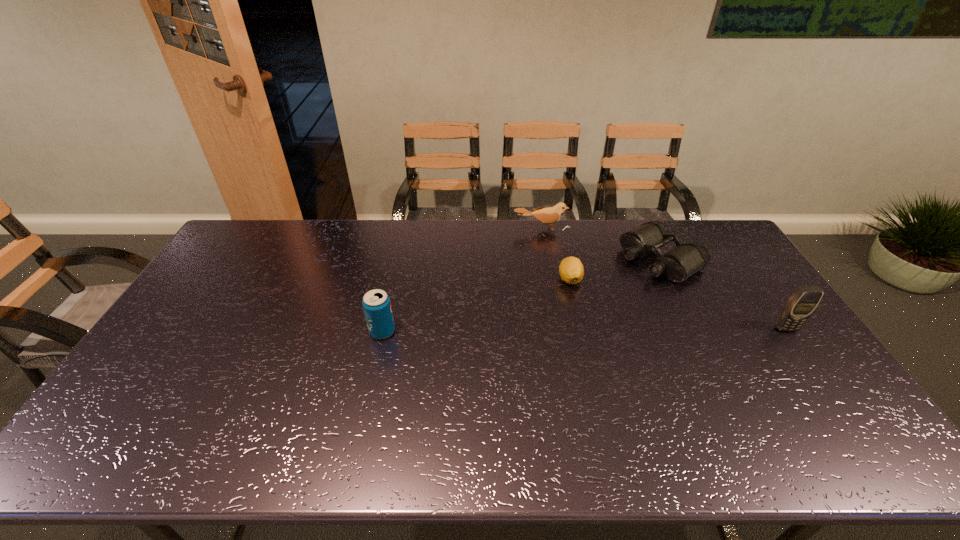
I want to click on vacant area located at the stem end of the shortest object, so click(x=540, y=364).

Identify the location of blank space located at the stem end of the shortest object. The width and height of the screenshot is (960, 540). (557, 321).

I want to click on vacant position located 0.100m at the stem end of the shortest object, so click(561, 309).

At what (x,y) coordinates should I click in order to perform the action: click on vacant region located through the eyepieces of the binoculars. Please return your answer as a coordinate pair (x, y). This screenshot has height=540, width=960. Looking at the image, I should click on (598, 296).

Where is `free spot located 0.310m through the eyepieces of the binoculars`? The width and height of the screenshot is (960, 540). free spot located 0.310m through the eyepieces of the binoculars is located at coordinates (568, 313).

I want to click on vacant point located through the eyepieces of the binoculars, so click(x=547, y=326).

At what (x,y) coordinates should I click in order to perform the action: click on vacant region located 0.180m at the beak of the farthest object. Please return your answer as a coordinate pair (x, y). This screenshot has width=960, height=540. Looking at the image, I should click on (548, 263).

Find the location of `vacant space located 0.230m at the beak of the farthest object`. vacant space located 0.230m at the beak of the farthest object is located at coordinates click(549, 272).

Where is `free region located 0.070m at the beak of the farthest object`? This screenshot has height=540, width=960. free region located 0.070m at the beak of the farthest object is located at coordinates click(x=544, y=244).

Where is `binoculars that is at the far edge`? binoculars that is at the far edge is located at coordinates (678, 264).